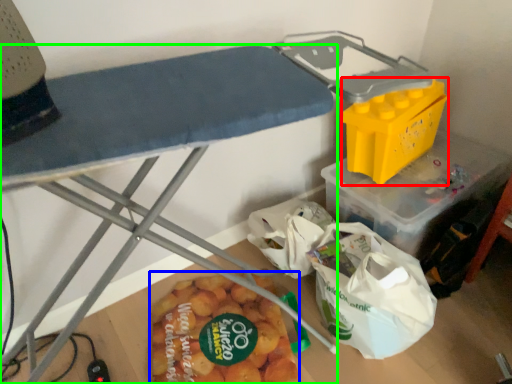
Question: Based on their relative distances, which object is nearer to box (highlighted by a red box)? Choose from food (highlighted by a blue box) and furniture (highlighted by a green box).

Choices:
 (A) food
 (B) furniture

Answer: (A)